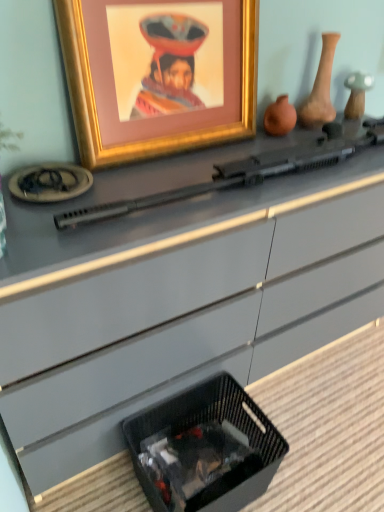
Question: Considering the positions of matte clay vase at upper right, the first vase from the right, and matte clay vase at upper center, the first vase in the left-to-right sequence, in the image, is matte clay vase at upper right, the first vase from the right, bigger or smaller than matte clay vase at upper center, the first vase in the left-to-right sequence,?

Choices:
 (A) small
 (B) big

Answer: (B)

Question: In terms of width, does matte clay vase at upper right, the first vase from the right, look wider or thinner when compared to matte clay vase at upper center, which is the second vase in right-to-left order?

Choices:
 (A) thin
 (B) wide

Answer: (B)

Question: Considering the real-world distances, which object is closest to the matte clay vase at upper right, the first vase from the right?

Choices:
 (A) gold-framed picture at upper center
 (B) black plastic rifle at center
 (C) black woven basket at lower center
 (D) matte clay vase at upper center, which is the second vase in right-to-left order

Answer: (D)

Question: Which object is positioned closest to the black woven basket at lower center?

Choices:
 (A) gold-framed picture at upper center
 (B) black plastic rifle at center
 (C) matte clay vase at upper right, the first vase from the right
 (D) matte clay vase at upper center, which is the second vase in right-to-left order

Answer: (B)